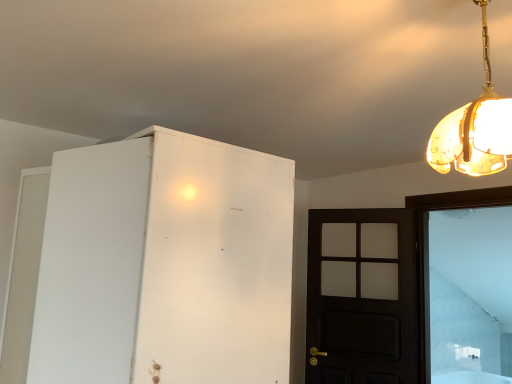
The height and width of the screenshot is (384, 512). Describe the element at coordinates (165, 264) in the screenshot. I see `white matte cabinet at left` at that location.

What is the approximate height of dark wood door at right?

4.12 feet.

The height and width of the screenshot is (384, 512). What do you see at coordinates (470, 295) in the screenshot? I see `white glass door at right` at bounding box center [470, 295].

What is the approximate height of translucent amber glass pendant light at upper right?

It is 19.70 inches.

Find the location of a particular element. white matte cabinet at left is located at coordinates (165, 264).

Find the location of a particular element. lamp above the white glass door at right (from the image's perspective) is located at coordinates (475, 128).

From a real-world perspective, is white glass door at right physically located above or below translucent amber glass pendant light at upper right?

Clearly, from a real-world perspective, white glass door at right is below translucent amber glass pendant light at upper right.

In the scene shown: From the image's perspective, would you say white glass door at right is positioned over translucent amber glass pendant light at upper right?

No, from the image's perspective, white glass door at right is not above translucent amber glass pendant light at upper right.

Is white glass door at right wider or thinner than translucent amber glass pendant light at upper right?

white glass door at right is thinner than translucent amber glass pendant light at upper right.

Consider the image. Does white glass door at right come in front of dark wood door at right?

Yes, white glass door at right is closer to the viewer.

From a real-world perspective, who is located lower, white glass door at right or dark wood door at right?

dark wood door at right.

Considering the positions of objects white glass door at right and dark wood door at right in the image provided, who is more to the right, white glass door at right or dark wood door at right?

white glass door at right is more to the right.

Identify the location of door to the left of white glass door at right. Image resolution: width=512 pixels, height=384 pixels. (362, 297).

Does white matte cabinet at left turn towards translucent amber glass pendant light at upper right?

No.

Is white matte cabinet at left not within translucent amber glass pendant light at upper right?

white matte cabinet at left is positioned outside translucent amber glass pendant light at upper right.

Is white matte cabinet at left placed right next to translucent amber glass pendant light at upper right?

white matte cabinet at left is not next to translucent amber glass pendant light at upper right, and they're not touching.

From the image's perspective, is white matte cabinet at left above or below translucent amber glass pendant light at upper right?

white matte cabinet at left is below translucent amber glass pendant light at upper right.

Which is behind, white matte cabinet at left or white glass door at right?

white glass door at right is further from the camera.

How distant is white matte cabinet at left from white glass door at right?

The distance of white matte cabinet at left from white glass door at right is 3.06 meters.

From the image's perspective, does white matte cabinet at left appear higher than white glass door at right?

Yes.

Considering the relative sizes of white matte cabinet at left and white glass door at right in the image provided, is white matte cabinet at left bigger than white glass door at right?

Yes, white matte cabinet at left is bigger than white glass door at right.

Can you confirm if dark wood door at right is positioned to the left of white matte cabinet at left?

Incorrect, dark wood door at right is not on the left side of white matte cabinet at left.

Would you say dark wood door at right is a long distance from white matte cabinet at left?

Yes.

Where is `door below the white matte cabinet at left (from a real-world perspective)`? door below the white matte cabinet at left (from a real-world perspective) is located at coordinates (362, 297).

Would you say white matte cabinet at left is outside dark wood door at right?

That's correct, white matte cabinet at left is outside of dark wood door at right.

Considering the sizes of objects white matte cabinet at left and dark wood door at right in the image provided, who is shorter, white matte cabinet at left or dark wood door at right?

white matte cabinet at left is shorter.

What's the angular difference between white matte cabinet at left and dark wood door at right's facing directions?

The angular difference between white matte cabinet at left and dark wood door at right is 32.1 degrees.

Visually, is white matte cabinet at left positioned to the left or to the right of dark wood door at right?

From the image, it's evident that white matte cabinet at left is to the left of dark wood door at right.

Image resolution: width=512 pixels, height=384 pixels. In the image, there is a translucent amber glass pendant light at upper right. Identify the location of cabinetry below it (from the image's perspective). pos(165,264).

Is white matte cabinet at left surrounded by translucent amber glass pendant light at upper right?

No, white matte cabinet at left is located outside of translucent amber glass pendant light at upper right.

Considering the sizes of objects translucent amber glass pendant light at upper right and white matte cabinet at left in the image provided, who is smaller, translucent amber glass pendant light at upper right or white matte cabinet at left?

Smaller between the two is translucent amber glass pendant light at upper right.

How far apart are translucent amber glass pendant light at upper right and white matte cabinet at left?

32.77 inches.

Image resolution: width=512 pixels, height=384 pixels. Find the location of `lamp lying in front of the white glass door at right`. lamp lying in front of the white glass door at right is located at coordinates (475, 128).

Identify the location of door located behind the white glass door at right. (362, 297).

Based on their spatial positions, is white glass door at right or dark wood door at right closer to white matte cabinet at left?

dark wood door at right is positioned closer to the anchor white matte cabinet at left.

Consider the image. Which object lies further to the anchor point white glass door at right, translucent amber glass pendant light at upper right or white matte cabinet at left?

translucent amber glass pendant light at upper right is further to white glass door at right.

Based on their spatial positions, is dark wood door at right or translucent amber glass pendant light at upper right further from white matte cabinet at left?

The object further to white matte cabinet at left is dark wood door at right.

Looking at the image, which one is located closer to translucent amber glass pendant light at upper right, white matte cabinet at left or dark wood door at right?

Among the two, white matte cabinet at left is located nearer to translucent amber glass pendant light at upper right.

Looking at the image, which one is located further to white matte cabinet at left, white glass door at right or translucent amber glass pendant light at upper right?

white glass door at right is further to white matte cabinet at left.

Based on their spatial positions, is white glass door at right or white matte cabinet at left closer to dark wood door at right?

The object closer to dark wood door at right is white glass door at right.

Considering their positions, is white matte cabinet at left positioned further to white glass door at right than dark wood door at right?

white matte cabinet at left is further to white glass door at right.

Looking at the image, which one is located closer to dark wood door at right, translucent amber glass pendant light at upper right or white glass door at right?

white glass door at right is positioned closer to the anchor dark wood door at right.

This screenshot has width=512, height=384. I want to click on window positioned between translucent amber glass pendant light at upper right and dark wood door at right from near to far, so click(470, 295).

In order to click on door between white matte cabinet at left and white glass door at right in the horizontal direction in this screenshot , I will do `click(362, 297)`.

Where is `lamp between white matte cabinet at left and white glass door at right from left to right`? Image resolution: width=512 pixels, height=384 pixels. lamp between white matte cabinet at left and white glass door at right from left to right is located at coordinates (475, 128).

You are a GUI agent. You are given a task and a screenshot of the screen. Output one action in this format:
    pyautogui.click(x=<x>, y=<y>)
    Task: Click on the cabinetry located between translucent amber glass pendant light at upper right and dark wood door at right in the depth direction
    The image size is (512, 384).
    Given the screenshot: What is the action you would take?
    pyautogui.click(x=165, y=264)